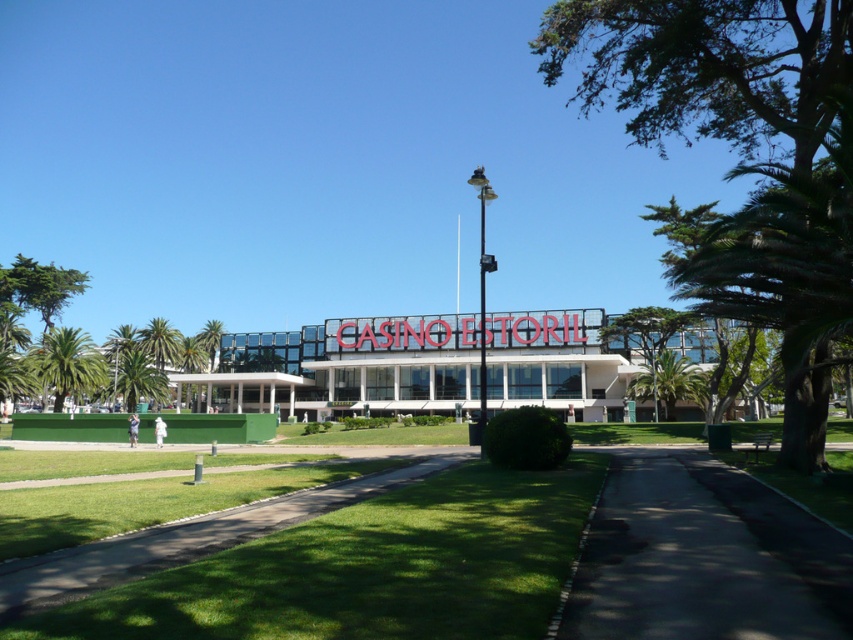
You are standing at the entrance of Casino Estoril and want to take a photo that includes both the casino building and the green leafy palm tree at left. Given that your camera has a maximum zoom range of 50 meters, will you be able to capture both in a single frame without moving your position?

The distance between the green leafy palm tree at left and the camera is 63.46 meters. Since your camera can only zoom up to 50 meters, you won